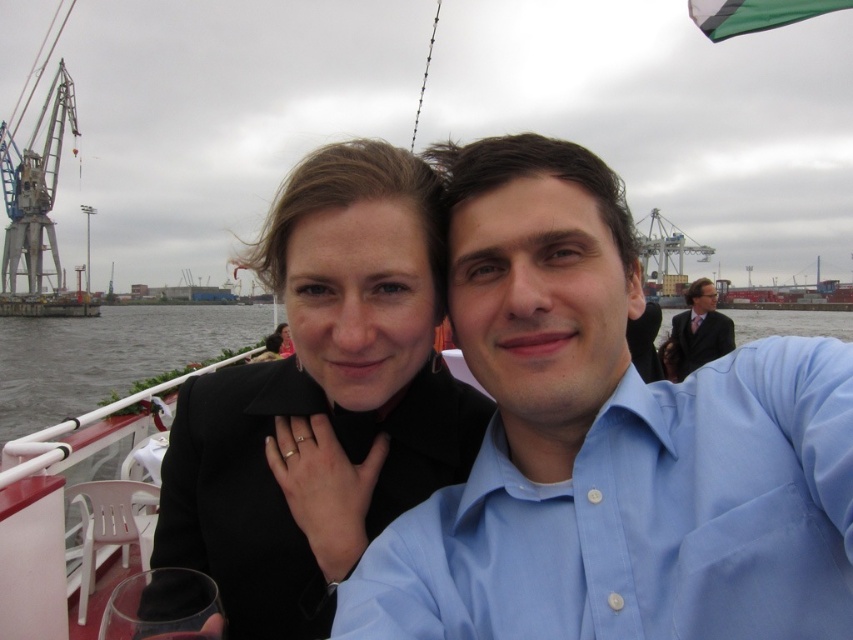
Is point (462, 596) less distant than point (178, 556)?

That is True.

Is light blue cotton shirt at upper right closer to camera compared to black matte jacket at center?

Yes, it is in front of black matte jacket at center.

Which is behind, point (503, 179) or point (268, 369)?

The point (268, 369) is behind.

Identify the location of light blue cotton shirt at upper right. Image resolution: width=853 pixels, height=640 pixels. (610, 445).

Which of these two, black matte jacket at center or dark suit at center, stands shorter?

Standing shorter between the two is dark suit at center.

Which is behind, point (190, 500) or point (665, 360)?

Positioned behind is point (665, 360).

Locate an element on the screen. black matte jacket at center is located at coordinates (322, 397).

Which is below, light blue cotton shirt at upper right or dark suit at center?

Positioned lower is light blue cotton shirt at upper right.

You are a GUI agent. You are given a task and a screenshot of the screen. Output one action in this format:
    pyautogui.click(x=<x>, y=<y>)
    Task: Click on the light blue cotton shirt at upper right
    The width and height of the screenshot is (853, 640).
    Given the screenshot: What is the action you would take?
    pyautogui.click(x=610, y=445)